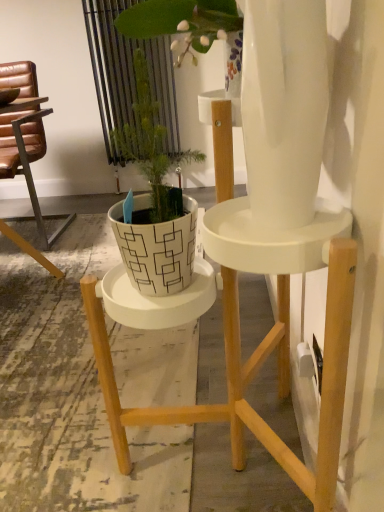
Question: Is the position of brown leather chair at left less distant than that of white matte pot at center?

Choices:
 (A) yes
 (B) no

Answer: (B)

Question: Considering the relative sizes of brown leather chair at left and white matte pot at center in the image provided, is brown leather chair at left wider than white matte pot at center?

Choices:
 (A) no
 (B) yes

Answer: (B)

Question: Can you confirm if brown leather chair at left is shorter than white matte pot at center?

Choices:
 (A) yes
 (B) no

Answer: (B)

Question: Is brown leather chair at left thinner than white matte pot at center?

Choices:
 (A) no
 (B) yes

Answer: (A)

Question: Considering the relative positions of brown leather chair at left and white matte pot at center in the image provided, is brown leather chair at left to the right of white matte pot at center from the viewer's perspective?

Choices:
 (A) yes
 (B) no

Answer: (B)

Question: Can you confirm if brown leather chair at left is bigger than white matte pot at center?

Choices:
 (A) no
 (B) yes

Answer: (B)

Question: Can you confirm if white matte pot at center is taller than brown leather chair at left?

Choices:
 (A) no
 (B) yes

Answer: (A)

Question: From the image's perspective, is white matte pot at center on brown leather chair at left?

Choices:
 (A) no
 (B) yes

Answer: (A)

Question: Can you confirm if white matte pot at center is thinner than brown leather chair at left?

Choices:
 (A) yes
 (B) no

Answer: (A)

Question: From the image's perspective, is white matte pot at center located beneath brown leather chair at left?

Choices:
 (A) no
 (B) yes

Answer: (B)

Question: Is white matte pot at center outside brown leather chair at left?

Choices:
 (A) yes
 (B) no

Answer: (A)

Question: Does white matte pot at center have a smaller size compared to brown leather chair at left?

Choices:
 (A) no
 (B) yes

Answer: (B)

Question: From a real-world perspective, is brown leather chair at left positioned above or below white matte pot at center?

Choices:
 (A) below
 (B) above

Answer: (A)